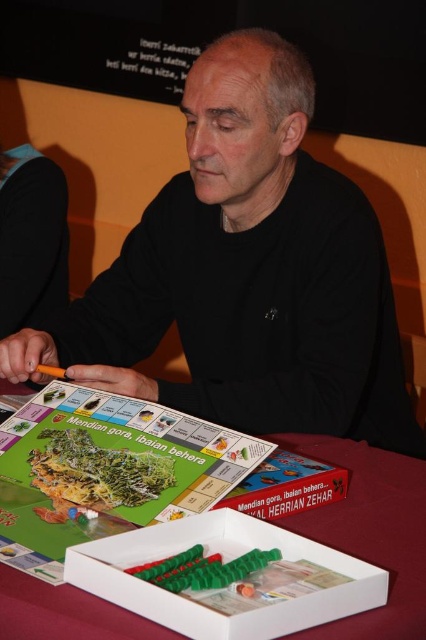
Which is behind, point (175, 256) or point (422, 516)?

The point (175, 256) is more distant.

From the picture: Between black matte shirt at center and red cloth at lower center, which one is positioned lower?

red cloth at lower center is lower down.

Who is more forward, (x=385, y=260) or (x=16, y=572)?

Point (x=16, y=572) is in front.

The width and height of the screenshot is (426, 640). Find the location of `black matte shirt at center`. black matte shirt at center is located at coordinates pyautogui.click(x=247, y=273).